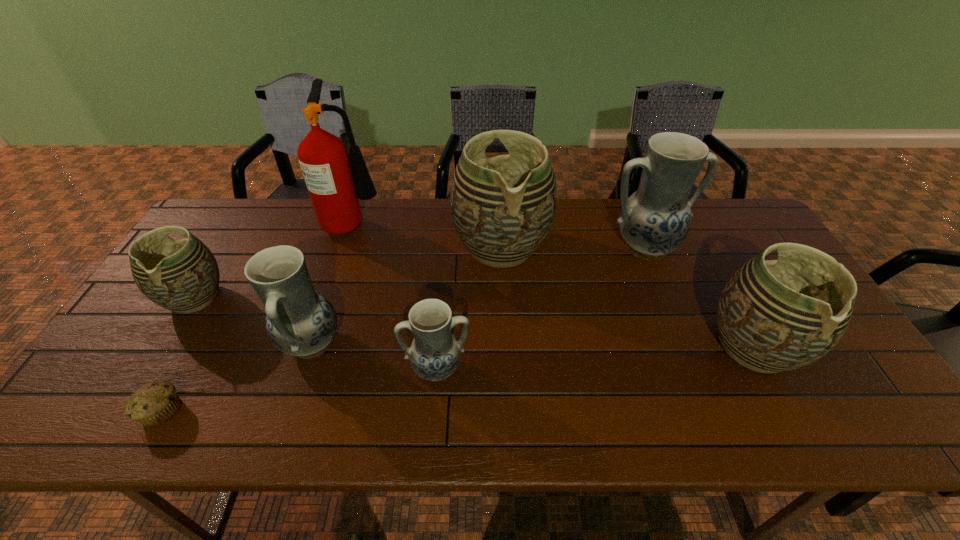
Choose which object is the sixth nearest neighbor to the biggest brown pottery. Please provide its 2D coordinates. Your answer should be formatted as a tuple, i.e. [(x, y)], where the tuple contains the x and y coordinates of a point satisfying the conditions above.

[(183, 276)]

Where is `object that is the third closest to the leftmost brown pottery`? This screenshot has height=540, width=960. object that is the third closest to the leftmost brown pottery is located at coordinates (323, 157).

Identify which pottery is located as the second nearest to the rightmost brown pottery. Please provide its 2D coordinates. Your answer should be formatted as a tuple, i.e. [(x, y)], where the tuple contains the x and y coordinates of a point satisfying the conditions above.

[(502, 208)]

Identify which pottery is located as the fifth nearest to the fifth pottery from right to left. Please provide its 2D coordinates. Your answer should be formatted as a tuple, i.e. [(x, y)], where the tuple contains the x and y coordinates of a point satisfying the conditions above.

[(773, 316)]

The image size is (960, 540). In order to click on blue pottery that stands as the closest to the muffin in this screenshot , I will do `click(300, 321)`.

Image resolution: width=960 pixels, height=540 pixels. Find the location of `blue pottery that stands as the closest to the smallest brown pottery`. blue pottery that stands as the closest to the smallest brown pottery is located at coordinates (300, 321).

At what (x,y) coordinates should I click in order to perform the action: click on brown pottery identified as the third closest to the fire extinguisher. Please return your answer as a coordinate pair (x, y). The height and width of the screenshot is (540, 960). Looking at the image, I should click on (773, 316).

Locate which brown pottery is the second closest to the second biggest brown pottery. Please provide its 2D coordinates. Your answer should be formatted as a tuple, i.e. [(x, y)], where the tuple contains the x and y coordinates of a point satisfying the conditions above.

[(183, 276)]

This screenshot has height=540, width=960. What are the coordinates of `free space that satisfies the following two spatial constraints: 1. at the nozzle of the second biggest brown pottery; 2. on the right side of the red fire extinguisher` in the screenshot? It's located at (312, 347).

This screenshot has width=960, height=540. I want to click on free spot that satisfies the following two spatial constraints: 1. on the front side of the second smallest brown pottery; 2. on the right side of the rightmost blue pottery, so click(x=685, y=347).